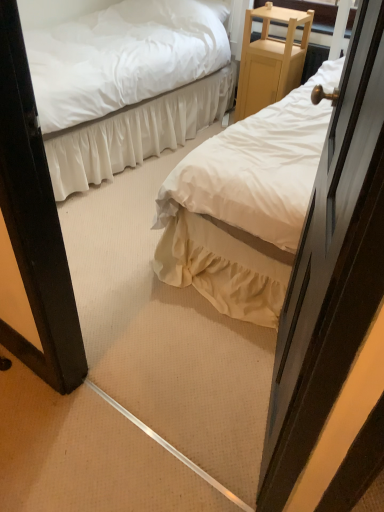
Question: Does wooden door at right have a larger size compared to white satin bed at center, arranged as the 1th bed when viewed from the left?

Choices:
 (A) yes
 (B) no

Answer: (B)

Question: Does wooden door at right appear on the left side of white satin bed at center, arranged as the 2th bed when viewed from the right?

Choices:
 (A) yes
 (B) no

Answer: (B)

Question: Is wooden door at right not near white satin bed at center, arranged as the 1th bed when viewed from the left?

Choices:
 (A) no
 (B) yes

Answer: (B)

Question: From a real-world perspective, is wooden door at right beneath white satin bed at center, arranged as the 2th bed when viewed from the right?

Choices:
 (A) yes
 (B) no

Answer: (B)

Question: Can you confirm if wooden door at right is taller than white satin bed at center, arranged as the 1th bed when viewed from the left?

Choices:
 (A) yes
 (B) no

Answer: (A)

Question: In terms of width, does wooden door at right look wider or thinner when compared to light wood/finely crafted nightstand at upper right?

Choices:
 (A) thin
 (B) wide

Answer: (A)

Question: Choose the correct answer: Is wooden door at right inside light wood/finely crafted nightstand at upper right or outside it?

Choices:
 (A) inside
 (B) outside

Answer: (B)

Question: From a real-world perspective, relative to light wood/finely crafted nightstand at upper right, is wooden door at right vertically above or below?

Choices:
 (A) below
 (B) above

Answer: (B)

Question: Considering the positions of point (306, 222) and point (266, 95), is point (306, 222) closer or farther from the camera than point (266, 95)?

Choices:
 (A) farther
 (B) closer

Answer: (B)

Question: Is light wood/finely crafted nightstand at upper right bigger or smaller than white satin bed at center, arranged as the 2th bed when viewed from the right?

Choices:
 (A) small
 (B) big

Answer: (A)

Question: From a real-world perspective, is light wood/finely crafted nightstand at upper right physically located above or below white satin bed at center, arranged as the 1th bed when viewed from the left?

Choices:
 (A) above
 (B) below

Answer: (B)

Question: Considering the positions of light wood/finely crafted nightstand at upper right and white satin bed at center, arranged as the 2th bed when viewed from the right, in the image, is light wood/finely crafted nightstand at upper right wider or thinner than white satin bed at center, arranged as the 2th bed when viewed from the right,?

Choices:
 (A) thin
 (B) wide

Answer: (A)

Question: Relative to white satin bed at center, arranged as the 1th bed when viewed from the left, is light wood/finely crafted nightstand at upper right in front or behind?

Choices:
 (A) front
 (B) behind

Answer: (B)

Question: Is white satin bed at center, arranged as the 1th bed when viewed from the left, spatially inside white cotton bed at center, which is the 2th bed in left-to-right order, or outside of it?

Choices:
 (A) outside
 (B) inside

Answer: (A)

Question: Is white satin bed at center, arranged as the 2th bed when viewed from the right, in front of or behind white cotton bed at center, which is the 2th bed in left-to-right order, in the image?

Choices:
 (A) behind
 (B) front

Answer: (A)